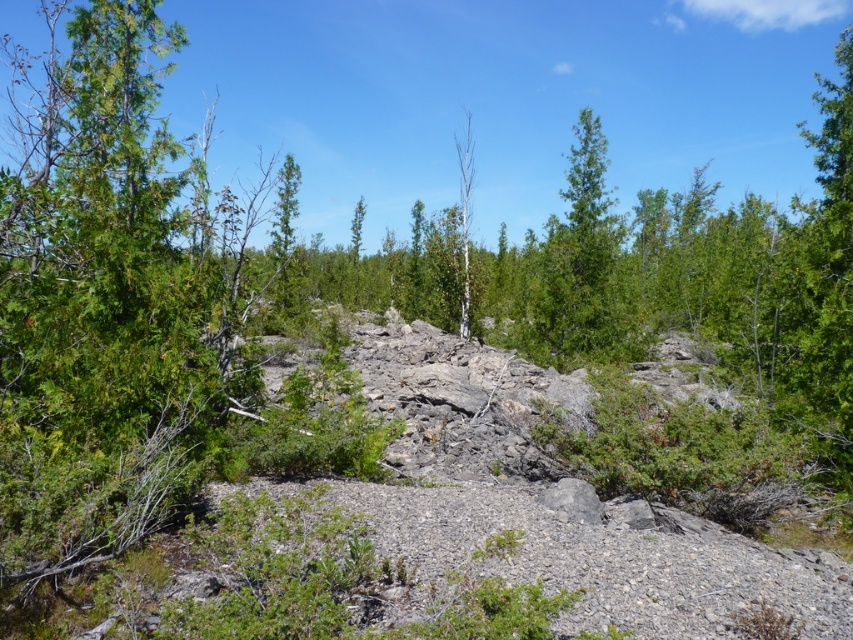
Can you confirm if green matte tree at center is positioned to the right of white smooth tree at center?

In fact, green matte tree at center is to the left of white smooth tree at center.

Which is above, green matte tree at center or white smooth tree at center?

white smooth tree at center

Who is more distant from viewer, (296, 188) or (460, 236)?

The point (296, 188) is more distant.

Find the location of `green matte tree at center`. green matte tree at center is located at coordinates (283, 230).